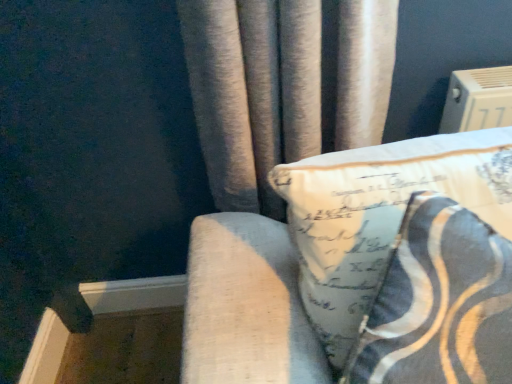
What is the approximate width of white fabric cushion at center?

It is 9.76 inches.

Measure the distance between point (x=377, y=154) and camera.

66.60 centimeters.

Find the location of a particular element. white fabric cushion at center is located at coordinates (322, 252).

This screenshot has height=384, width=512. What do you see at coordinates (322, 252) in the screenshot?
I see `white fabric cushion at center` at bounding box center [322, 252].

Find the location of a particular element. white fabric cushion at center is located at coordinates (322, 252).